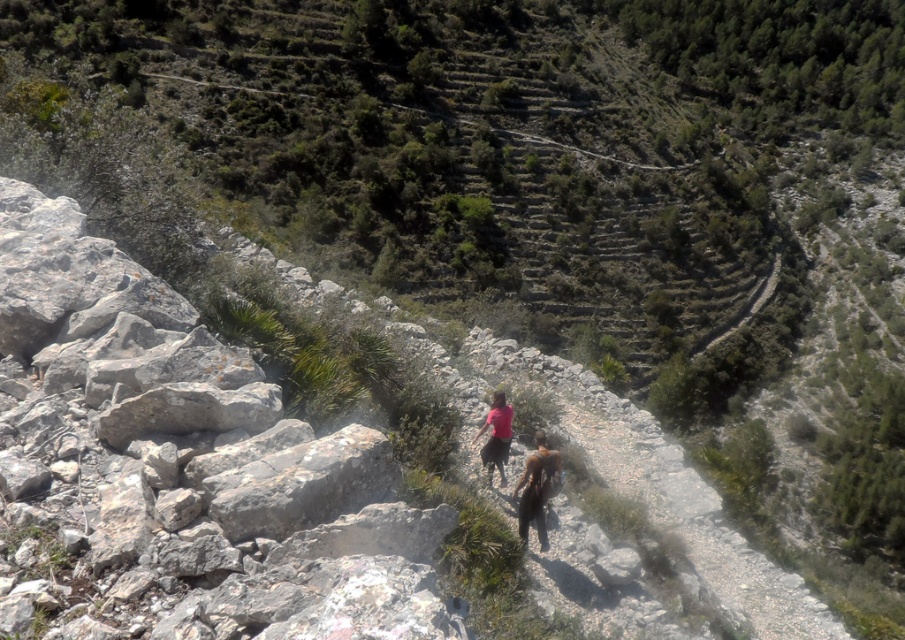
Question: Which of the following is the closest to the observer?

Choices:
 (A) (505, 461)
 (B) (135, 296)

Answer: (B)

Question: Does gray rough rock at left appear under dark brown leather jacket at center?

Choices:
 (A) yes
 (B) no

Answer: (B)

Question: Can you confirm if gray rough rock at left is bigger than matte pink shirt at center?

Choices:
 (A) no
 (B) yes

Answer: (A)

Question: Where is gray rough rock at left located in relation to dark brown leather jacket at center in the image?

Choices:
 (A) below
 (B) above

Answer: (B)

Question: Which point is closer to the camera?

Choices:
 (A) (539, 470)
 (B) (150, 468)
 (C) (489, 422)

Answer: (B)

Question: Among these points, which one is nearest to the camera?

Choices:
 (A) (536, 464)
 (B) (503, 474)

Answer: (A)